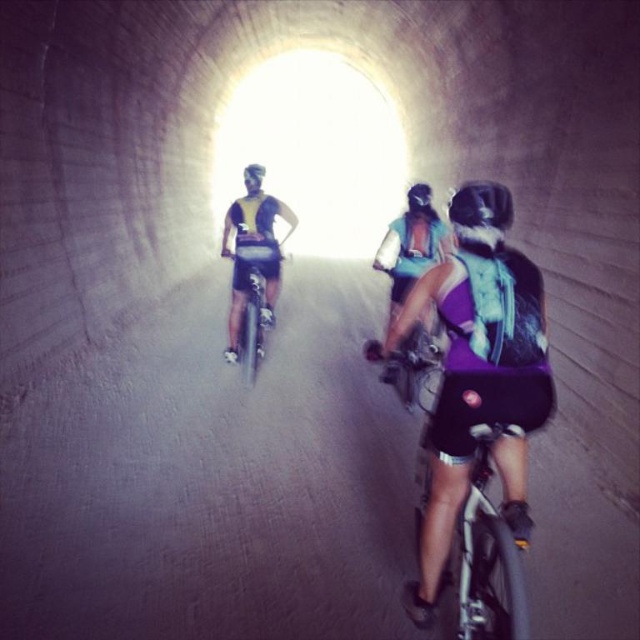
Does matte black shorts at center lie in front of purple fabric shorts at center?

No, it is behind purple fabric shorts at center.

Describe the element at coordinates (250, 257) in the screenshot. I see `matte black shorts at center` at that location.

This screenshot has height=640, width=640. In order to click on matte black shorts at center in this screenshot , I will do `click(250, 257)`.

Based on the photo, is purple fabric bag at center taller than matte white helmet at center?

Yes.

This screenshot has height=640, width=640. Find the location of `purple fabric bag at center`. purple fabric bag at center is located at coordinates tap(476, 372).

Can you confirm if matte black shorts at center is positioned to the right of matte black helmet at center?

No, matte black shorts at center is not to the right of matte black helmet at center.

From the picture: Between matte black shorts at center and matte black helmet at center, which one has less height?

With less height is matte black helmet at center.

Between point (266, 262) and point (420, 182), which one is positioned in front?

Point (266, 262) is more forward.

Where is `matte black shorts at center`? matte black shorts at center is located at coordinates (250, 257).